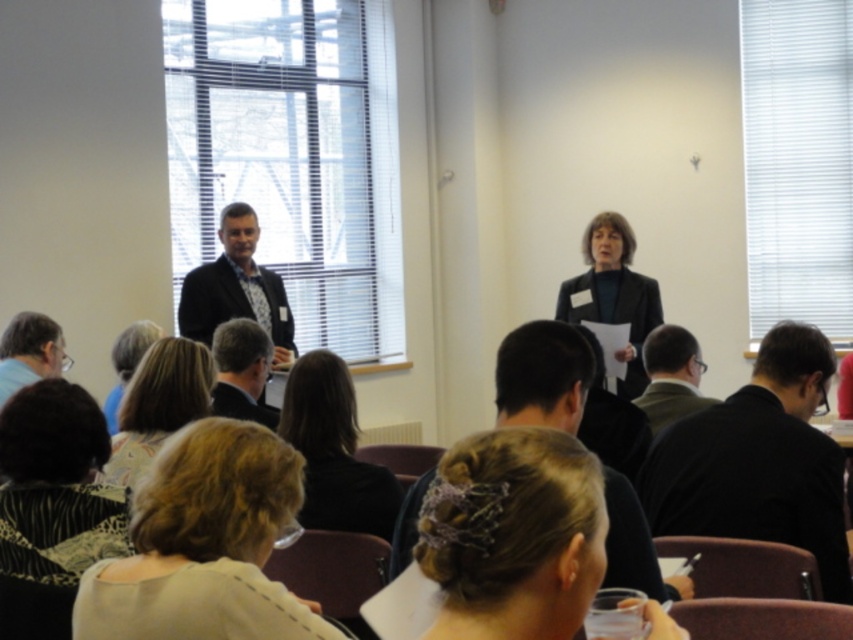
Question: Which of the following is the farthest from the observer?

Choices:
 (A) dark brown hair at lower center
 (B) matte black blazer at center
 (C) dark gray suit at left
 (D) zebra print scarf at lower left

Answer: (C)

Question: Is light beige fabric hair at center wider than dark gray suit at left?

Choices:
 (A) yes
 (B) no

Answer: (B)

Question: Which point is closer to the camera?

Choices:
 (A) dark gray suit at left
 (B) zebra print scarf at lower left
 (C) light beige fabric hair at center
 (D) black matte jacket at lower right

Answer: (C)

Question: Where is matte black blazer at center located in relation to dark brown hair at lower center in the image?

Choices:
 (A) right
 (B) left

Answer: (B)

Question: Which object appears closest to the camera in this image?

Choices:
 (A) light brown hair at lower left
 (B) dark suit at center
 (C) dark gray suit at left

Answer: (B)

Question: Can you confirm if dark brown hair at center is positioned above light brown hair at lower left?

Choices:
 (A) no
 (B) yes

Answer: (A)